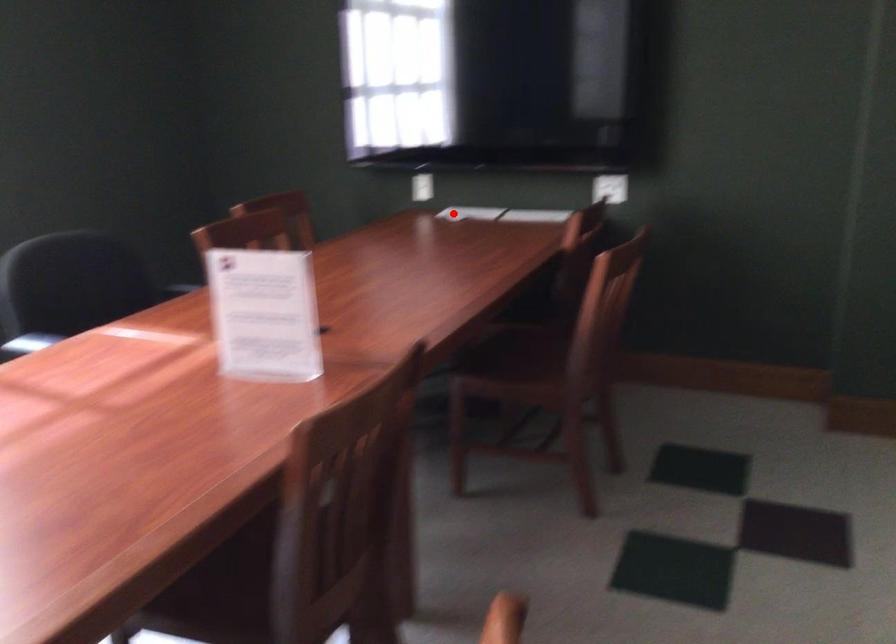
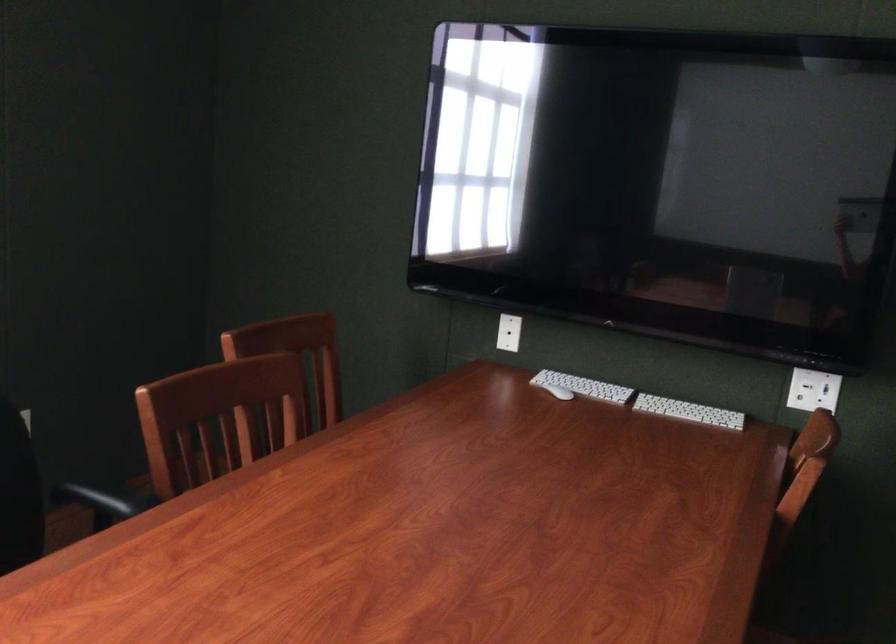
Question: I am providing you with two images of the same scene from different viewpoints. A red point is shown in image1. For the corresponding object point in image2, is it positioned nearer or farther from the camera?

Choices:
 (A) Nearer
 (B) Farther

Answer: (A)